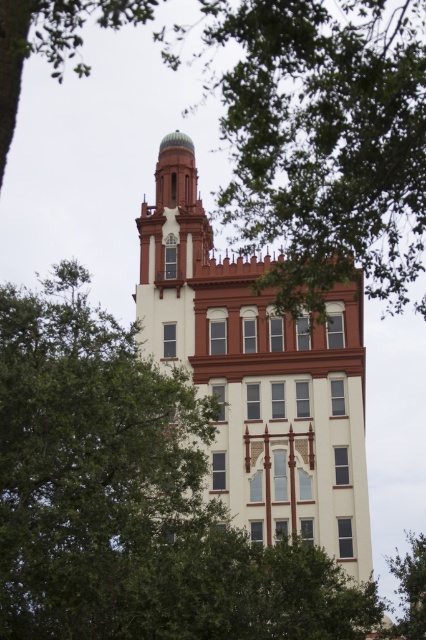
How far apart are white painted brick tower at center and green leafy tree at lower right?

white painted brick tower at center and green leafy tree at lower right are 21.17 meters apart from each other.

Can you confirm if white painted brick tower at center is positioned to the left of green leafy tree at lower right?

Indeed, white painted brick tower at center is positioned on the left side of green leafy tree at lower right.

Is point (154, 342) closer to viewer compared to point (408, 628)?

No, (154, 342) is further to viewer.

Where is `white painted brick tower at center`? white painted brick tower at center is located at coordinates (264, 403).